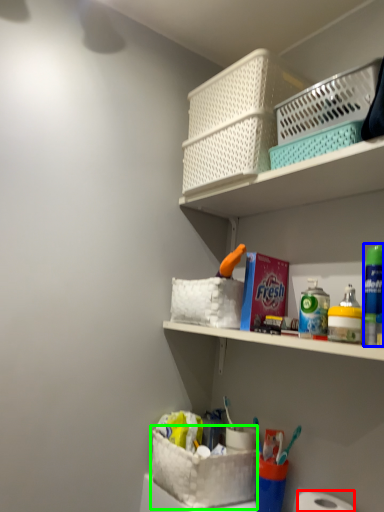
Question: Considering the real-world distances, which object is farthest from toilet paper (highlighted by a red box)? mouthwash (highlighted by a blue box) or basket container (highlighted by a green box)?

Choices:
 (A) mouthwash
 (B) basket container

Answer: (A)